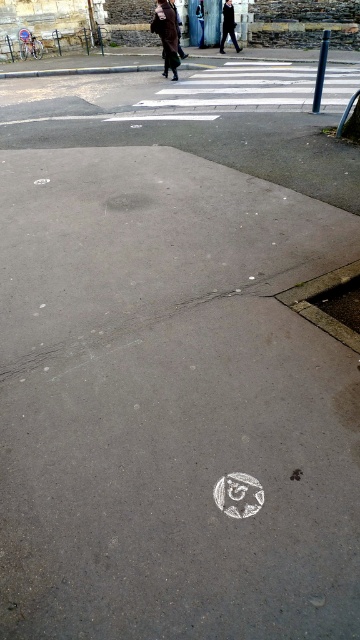
You are a GUI agent. You are given a task and a screenshot of the screen. Output one action in this format:
    pyautogui.click(x=<x>, y=<y>)
    Task: Click on the brown wool coat at upper center
    Image resolution: width=360 pixels, height=640 pixels.
    Given the screenshot: What is the action you would take?
    pyautogui.click(x=167, y=35)